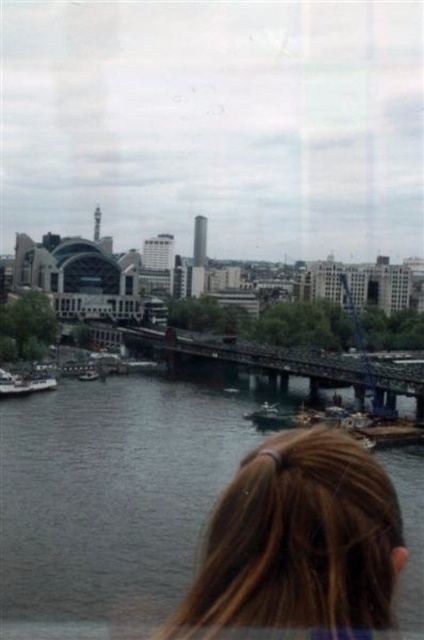
Is dark brown metal bridge at center positioned at the back of metallic silver boat at center?

No, it is not.

Can you confirm if dark brown metal bridge at center is positioned to the right of metallic silver boat at center?

Correct, you'll find dark brown metal bridge at center to the right of metallic silver boat at center.

Is point (398, 362) positioned in front of point (78, 376)?

That is False.

Image resolution: width=424 pixels, height=640 pixels. Find the location of `dark brown metal bridge at center`. dark brown metal bridge at center is located at coordinates (298, 365).

The image size is (424, 640). Describe the element at coordinates (298, 544) in the screenshot. I see `brown hair at lower center` at that location.

Which is behind, point (323, 488) or point (3, 387)?

The point (3, 387) is more distant.

In order to click on brown hair at lower center in this screenshot , I will do `click(298, 544)`.

Can you confirm if dark gray water at center is wider than brown hair at lower center?

Indeed, dark gray water at center has a greater width compared to brown hair at lower center.

Looking at this image, is dark gray water at center closer to camera compared to brown hair at lower center?

No, it is not.

Does point (94, 528) come closer to viewer compared to point (354, 557)?

No.

The image size is (424, 640). In order to click on dark gray water at center in this screenshot , I will do `click(108, 500)`.